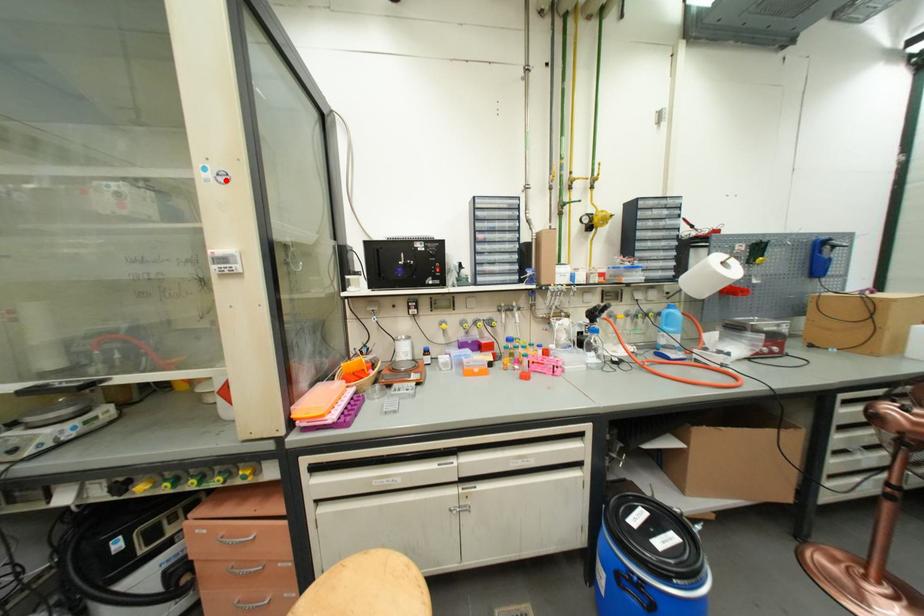
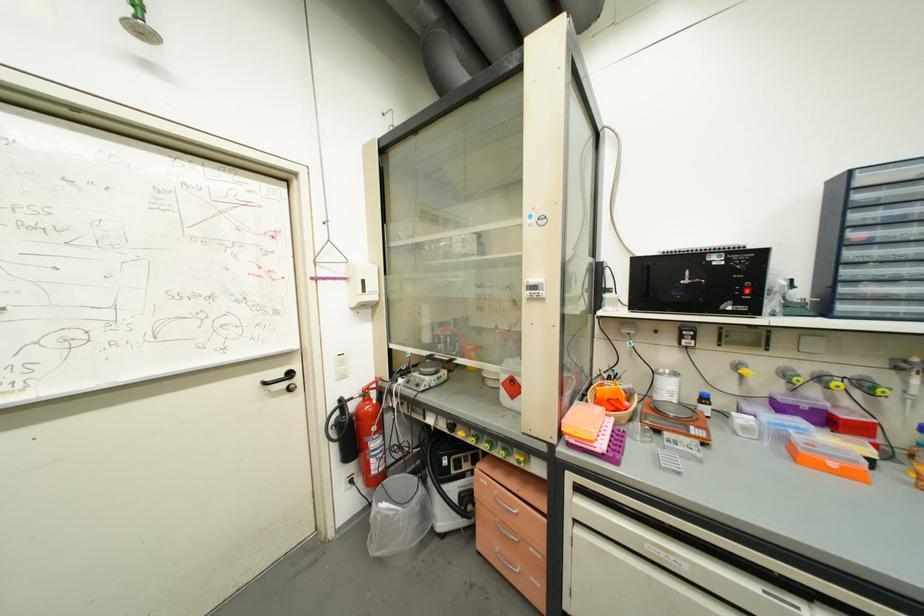
Where in the second image is the point corresponding to the highlighted location from the first image?

(544, 224)